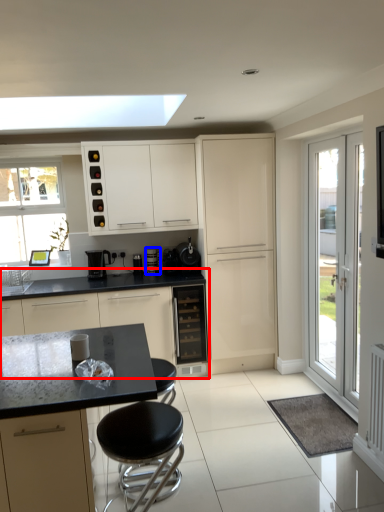
Question: Which of the following is the farthest to the observer, cabinetry (highlighted by a red box) or coffee machine (highlighted by a blue box)?

Choices:
 (A) cabinetry
 (B) coffee machine

Answer: (B)